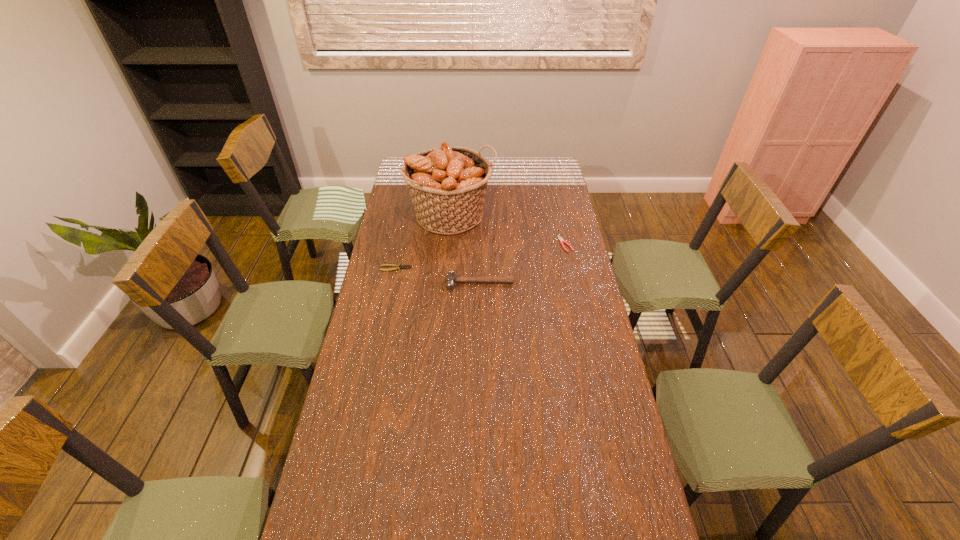
Where is `free spot between the tallest object and the hammer`? free spot between the tallest object and the hammer is located at coordinates (466, 248).

At what (x,y) coordinates should I click in order to perform the action: click on vacant space that's between the basket and the farther pliers. Please return your answer as a coordinate pair (x, y). Image resolution: width=960 pixels, height=540 pixels. Looking at the image, I should click on (509, 230).

Find the location of a particular element. Image resolution: width=960 pixels, height=540 pixels. vacant space that is in between the right pliers and the third shortest object is located at coordinates point(522,264).

Identify the location of unoccupied area between the nearer pliers and the tallest object. (424, 241).

I want to click on the third closest object relative to the basket, so click(x=562, y=241).

Locate an element on the screen. the second closest object to the third shortest object is located at coordinates (447, 184).

Locate which pliers ranks second in proximity to the tallest object. Please provide its 2D coordinates. Your answer should be formatted as a tuple, i.e. [(x, y)], where the tuple contains the x and y coordinates of a point satisfying the conditions above.

[(562, 241)]

Choose which pliers is the nearest neighbor to the second tallest object. Please provide its 2D coordinates. Your answer should be formatted as a tuple, i.e. [(x, y)], where the tuple contains the x and y coordinates of a point satisfying the conditions above.

[(396, 267)]